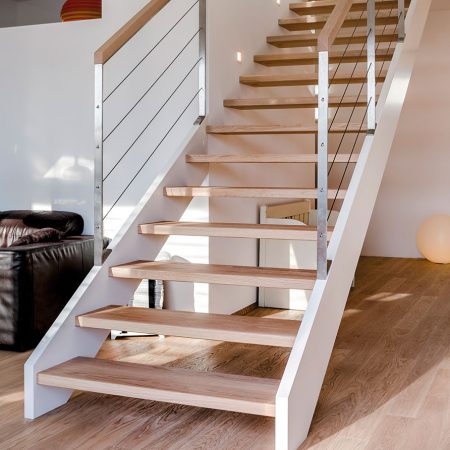
The image size is (450, 450). Identify the location of sunbeam on floor. (377, 294), (398, 296), (415, 414), (293, 318), (15, 394).